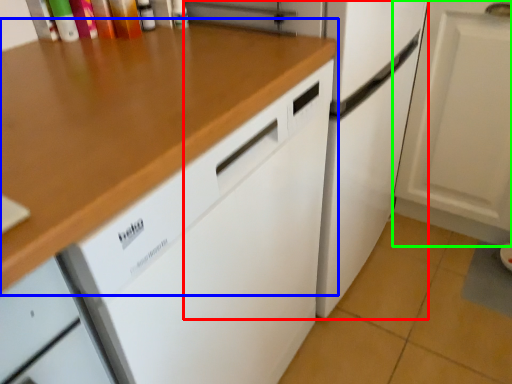
Question: Which is farther away from refrigerator (highlighted by a red box)? countertop (highlighted by a blue box) or cabinetry (highlighted by a green box)?

Choices:
 (A) countertop
 (B) cabinetry

Answer: (A)